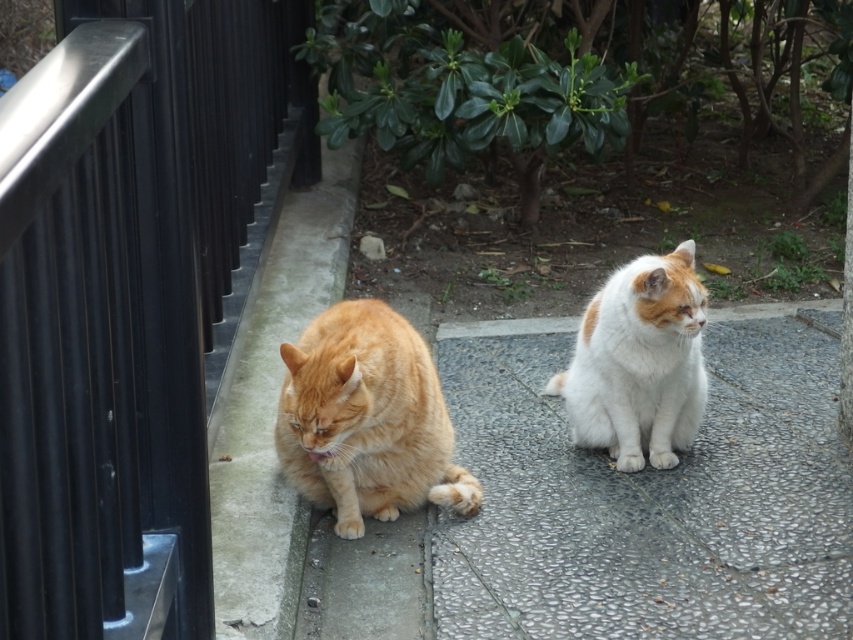
Measure the distance between black metal rail at left and camera.

black metal rail at left and camera are 11.76 feet apart.

Is black metal rail at left closer to the viewer compared to orange fur cat at left?

No, black metal rail at left is behind orange fur cat at left.

Does point (144, 532) come behind point (422, 426)?

No, (144, 532) is in front of (422, 426).

This screenshot has height=640, width=853. Find the location of `black metal rail at left`. black metal rail at left is located at coordinates (131, 296).

Measure the distance between white speckled concrete at center and camera.

They are 3.33 meters apart.

Based on the photo, is white speckled concrete at center closer to camera compared to orange fur cat at left?

Yes, it is in front of orange fur cat at left.

This screenshot has width=853, height=640. I want to click on white speckled concrete at center, so click(648, 496).

The image size is (853, 640). In order to click on white speckled concrete at center in this screenshot , I will do `click(648, 496)`.

Is black metal rail at left positioned before white speckled concrete at center?

No, it is not.

Between black metal rail at left and white speckled concrete at center, which one is positioned higher?

black metal rail at left is above.

The width and height of the screenshot is (853, 640). Identify the location of black metal rail at left. (131, 296).